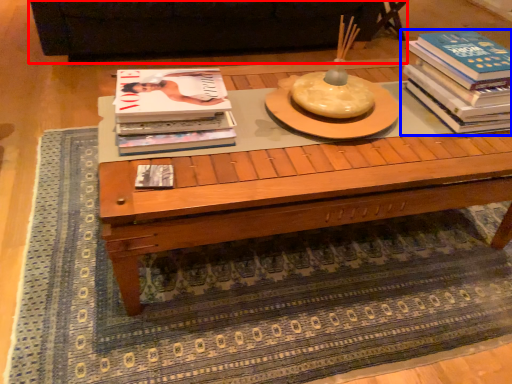
Question: Which point is closer to the camera, couch (highlighted by a red box) or book (highlighted by a blue box)?

Choices:
 (A) couch
 (B) book

Answer: (B)